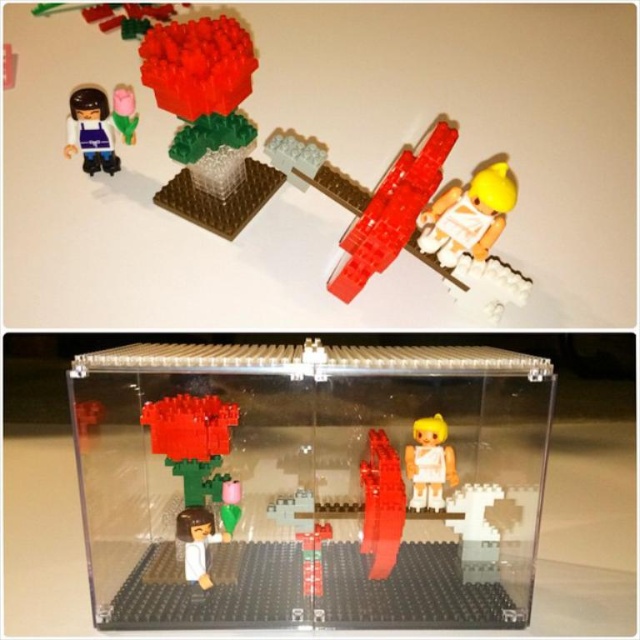
Does white glossy minifigure at right appear over matte purple plastic figure at upper left?

Actually, white glossy minifigure at right is below matte purple plastic figure at upper left.

Between white glossy minifigure at right and matte purple plastic figure at upper left, which one is positioned higher?

Positioned higher is matte purple plastic figure at upper left.

What do you see at coordinates (467, 216) in the screenshot? I see `white glossy minifigure at right` at bounding box center [467, 216].

Locate an element on the screen. The width and height of the screenshot is (640, 640). white glossy minifigure at right is located at coordinates (467, 216).

Measure the distance from translucent red plastic sword at upper right to translucent plastic brick at center.

A distance of 17.28 inches exists between translucent red plastic sword at upper right and translucent plastic brick at center.

What do you see at coordinates (392, 211) in the screenshot? I see `translucent red plastic sword at upper right` at bounding box center [392, 211].

The height and width of the screenshot is (640, 640). I want to click on translucent red plastic sword at upper right, so click(x=392, y=211).

Who is higher up, white glossy minifigure at center or translucent plastic brick at center?

white glossy minifigure at center is above.

Who is shorter, white glossy minifigure at center or translucent plastic brick at center?

With less height is translucent plastic brick at center.

Which is in front, point (412, 449) or point (300, 508)?

Point (300, 508) is in front.

The height and width of the screenshot is (640, 640). What are the coordinates of `white glossy minifigure at center` in the screenshot? It's located at (429, 464).